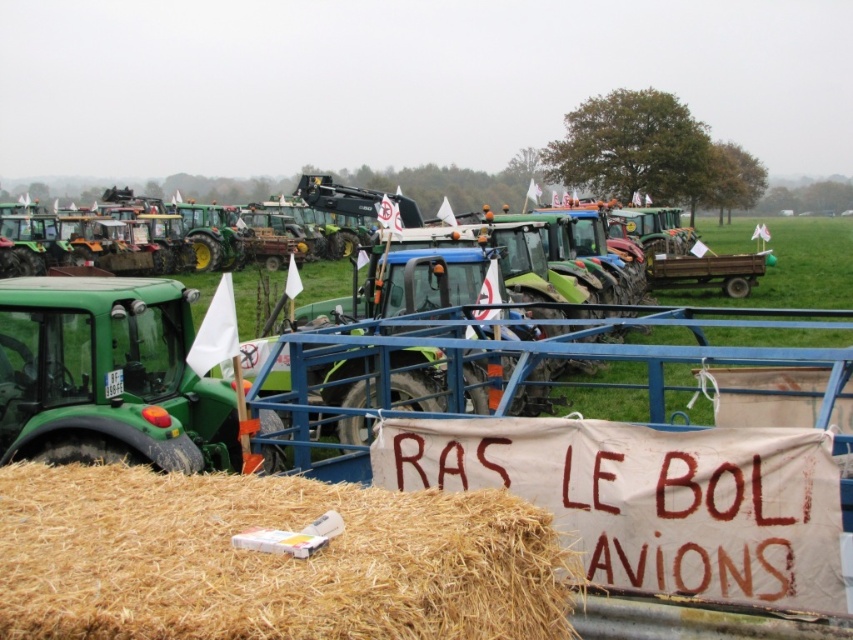
Which is more to the left, straw bale at lower center or white fabric banner at center?

Positioned to the left is straw bale at lower center.

Measure the distance between point (82,636) and camera.

Point (82,636) is 2.06 meters from camera.

Locate an element on the screen. This screenshot has width=853, height=640. straw bale at lower center is located at coordinates pos(267,560).